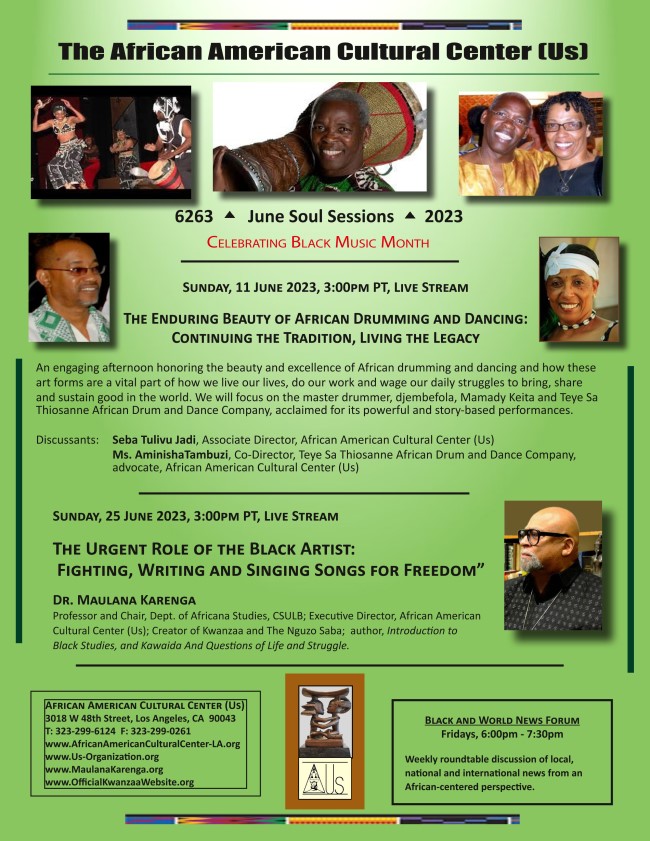
The width and height of the screenshot is (650, 841). In order to click on sculpture in this screenshot , I will do `click(320, 734)`.